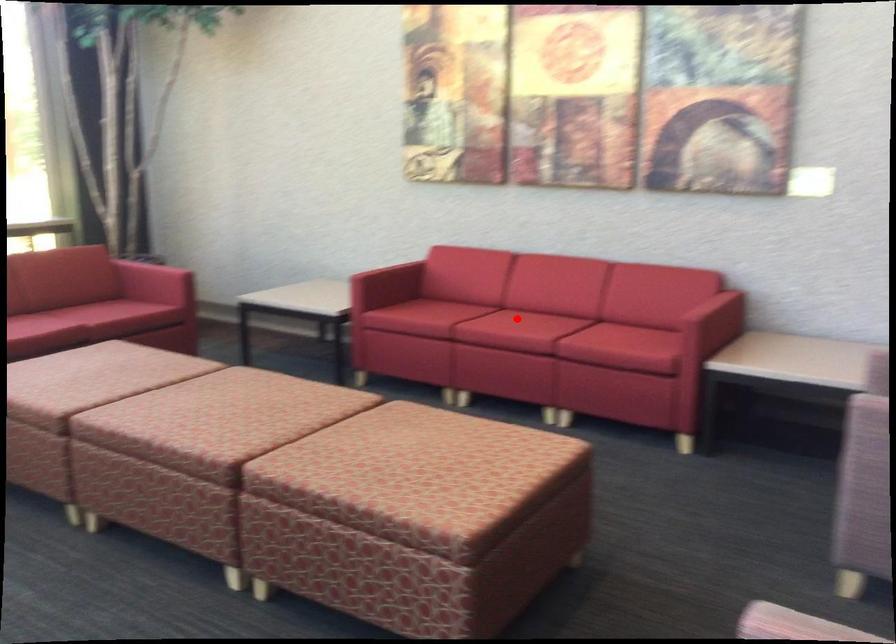
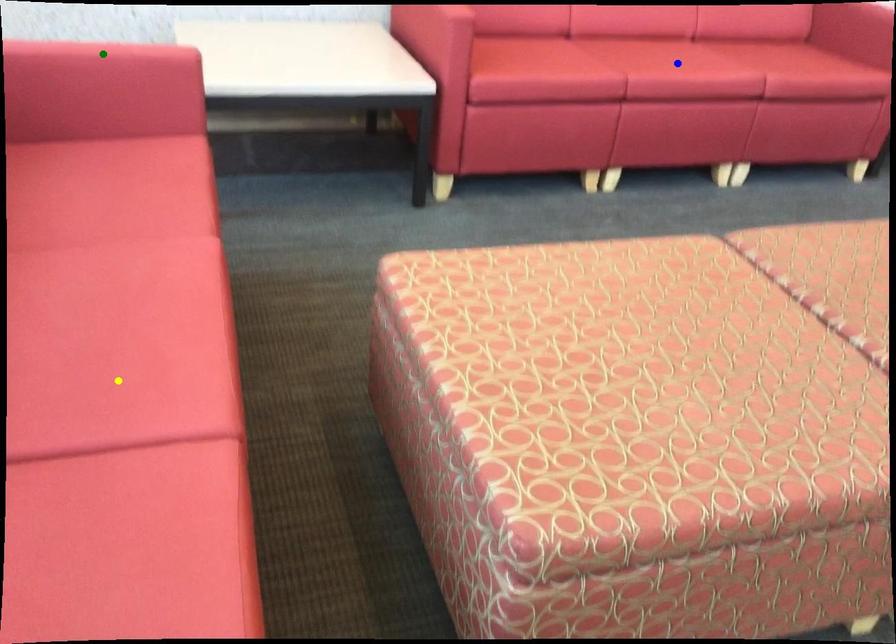
Question: I am providing you with two images of the same scene from different viewpoints. A red point is marked on the first image. You are given multiple points on the second image. Which point in image 2 represents the same 3d spot as the red point in image 1?

Choices:
 (A) blue point
 (B) yellow point
 (C) green point

Answer: (A)